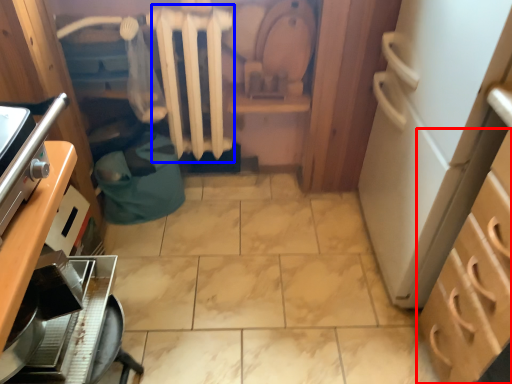
Question: Which of the following is the farthest to the observer, cabinetry (highlighted by a red box) or radiator (highlighted by a blue box)?

Choices:
 (A) cabinetry
 (B) radiator

Answer: (B)